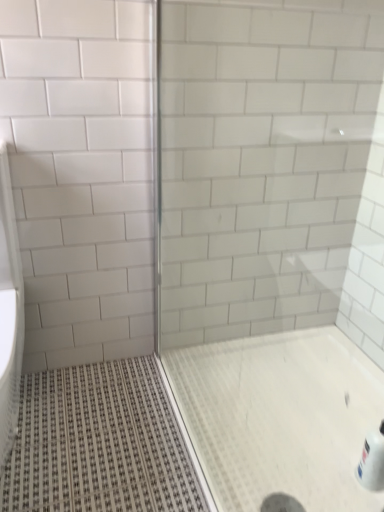
Measure the distance between transparent glass screen door at center and camera.

transparent glass screen door at center is 3.59 feet from camera.

This screenshot has width=384, height=512. Identify the location of transparent glass screen door at center. pyautogui.click(x=274, y=243).

Describe the element at coordinates (274, 243) in the screenshot. The height and width of the screenshot is (512, 384). I see `transparent glass screen door at center` at that location.

What do you see at coordinates (372, 461) in the screenshot?
I see `white glossy bottle at lower right` at bounding box center [372, 461].

Identify the location of white glossy bottle at lower right. (372, 461).

What are the coordinates of `transparent glass screen door at center` in the screenshot? It's located at (274, 243).

Visually, is transparent glass screen door at center positioned to the left or to the right of white glossy bottle at lower right?

transparent glass screen door at center is positioned on white glossy bottle at lower right's left side.

Is the position of transparent glass screen door at center less distant than that of white glossy bottle at lower right?

Yes.

Which is closer to the camera, (268, 263) or (380, 452)?

Point (268, 263) appears to be farther away from the viewer than point (380, 452).

From the image's perspective, which is below, transparent glass screen door at center or white glossy bottle at lower right?

white glossy bottle at lower right, from the image's perspective.

From a real-world perspective, is transparent glass screen door at center physically located above or below white glossy bottle at lower right?

Clearly, from a real-world perspective, transparent glass screen door at center is above white glossy bottle at lower right.

Considering the sizes of objects transparent glass screen door at center and white glossy bottle at lower right in the image provided, who is wider, transparent glass screen door at center or white glossy bottle at lower right?

transparent glass screen door at center.

In terms of height, does transparent glass screen door at center look taller or shorter compared to white glossy bottle at lower right?

transparent glass screen door at center is taller than white glossy bottle at lower right.

Can you confirm if transparent glass screen door at center is smaller than white glossy bottle at lower right?

No.

Would you say transparent glass screen door at center is outside white glossy bottle at lower right?

Yes.

Are transparent glass screen door at center and white glossy bottle at lower right located far from each other?

No, transparent glass screen door at center is not far away from white glossy bottle at lower right.

Looking at this image, is transparent glass screen door at center oriented towards white glossy bottle at lower right?

No, transparent glass screen door at center is not facing towards white glossy bottle at lower right.

How many degrees apart are the facing directions of transparent glass screen door at center and white glossy bottle at lower right?

87.1 degrees separate the facing orientations of transparent glass screen door at center and white glossy bottle at lower right.

Based on the photo, how much distance is there between transparent glass screen door at center and white glossy bottle at lower right?

They are 68.20 centimeters apart.

Locate an element on the screen. bottle below the transparent glass screen door at center (from the image's perspective) is located at coordinates (372, 461).

Is white glossy bottle at lower right to the right of transparent glass screen door at center from the viewer's perspective?

Indeed, white glossy bottle at lower right is positioned on the right side of transparent glass screen door at center.

Looking at this image, which object is closer to the camera taking this photo, white glossy bottle at lower right or transparent glass screen door at center?

transparent glass screen door at center is closer to the camera.

Which is in front, point (383, 471) or point (363, 119)?

Point (383, 471)

From the image's perspective, who appears lower, white glossy bottle at lower right or transparent glass screen door at center?

white glossy bottle at lower right appears lower in the image.

From a real-world perspective, which is physically below, white glossy bottle at lower right or transparent glass screen door at center?

white glossy bottle at lower right.

Which object is thinner, white glossy bottle at lower right or transparent glass screen door at center?

white glossy bottle at lower right is thinner.

Is white glossy bottle at lower right shorter than transparent glass screen door at center?

Correct, white glossy bottle at lower right is not as tall as transparent glass screen door at center.

Consider the image. Considering the sizes of objects white glossy bottle at lower right and transparent glass screen door at center in the image provided, who is smaller, white glossy bottle at lower right or transparent glass screen door at center?

white glossy bottle at lower right is smaller.

Is white glossy bottle at lower right situated inside transparent glass screen door at center or outside?

white glossy bottle at lower right cannot be found inside transparent glass screen door at center.

Is white glossy bottle at lower right not close to transparent glass screen door at center?

Actually, white glossy bottle at lower right and transparent glass screen door at center are a little close together.

Is white glossy bottle at lower right oriented away from transparent glass screen door at center?

That's not correct — white glossy bottle at lower right is not looking away from transparent glass screen door at center.

What's the angular difference between white glossy bottle at lower right and transparent glass screen door at center's facing directions?

87.1 degrees.

Find the location of `bottle lying on the right of transparent glass screen door at center`. bottle lying on the right of transparent glass screen door at center is located at coordinates [x=372, y=461].

Image resolution: width=384 pixels, height=512 pixels. I want to click on bottle located underneath the transparent glass screen door at center (from a real-world perspective), so click(372, 461).

Find the location of a particular element. The height and width of the screenshot is (512, 384). screen door lying in front of the white glossy bottle at lower right is located at coordinates (274, 243).